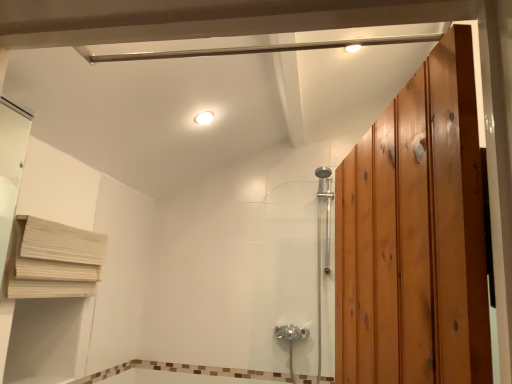
Question: Considering the relative sizes of white glossy light fixture at upper center and chrome metallic shower door at center in the image provided, is white glossy light fixture at upper center taller than chrome metallic shower door at center?

Choices:
 (A) no
 (B) yes

Answer: (A)

Question: Considering the relative sizes of white glossy light fixture at upper center and chrome metallic shower door at center in the image provided, is white glossy light fixture at upper center shorter than chrome metallic shower door at center?

Choices:
 (A) yes
 (B) no

Answer: (A)

Question: From a real-world perspective, is white glossy light fixture at upper center positioned under chrome metallic shower door at center based on gravity?

Choices:
 (A) no
 (B) yes

Answer: (A)

Question: Is white glossy light fixture at upper center outside chrome metallic shower door at center?

Choices:
 (A) no
 (B) yes

Answer: (B)

Question: Does white glossy light fixture at upper center contain chrome metallic shower door at center?

Choices:
 (A) yes
 (B) no

Answer: (B)

Question: Could you tell me if white glossy light fixture at upper center is turned towards chrome metallic shower door at center?

Choices:
 (A) no
 (B) yes

Answer: (A)

Question: From a real-world perspective, is wooden at left on top of brown mosaic tile at lower center?

Choices:
 (A) yes
 (B) no

Answer: (A)

Question: Can you confirm if wooden at left is wider than brown mosaic tile at lower center?

Choices:
 (A) no
 (B) yes

Answer: (B)

Question: Are wooden at left and brown mosaic tile at lower center making contact?

Choices:
 (A) no
 (B) yes

Answer: (A)

Question: From a real-world perspective, is wooden at left under brown mosaic tile at lower center?

Choices:
 (A) no
 (B) yes

Answer: (A)

Question: Can you confirm if wooden at left is bigger than brown mosaic tile at lower center?

Choices:
 (A) yes
 (B) no

Answer: (A)

Question: Does wooden at left appear on the left side of brown mosaic tile at lower center?

Choices:
 (A) yes
 (B) no

Answer: (A)

Question: Is chrome metallic shower door at center taller than white glossy light fixture at upper center?

Choices:
 (A) no
 (B) yes

Answer: (B)